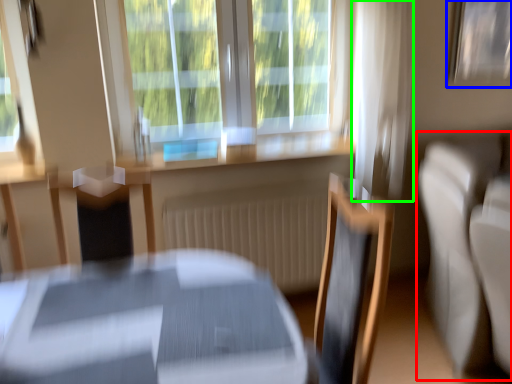
Question: Estimate the real-world distances between objects in this image. Which object is farther from couch (highlighted by a red box), picture frame (highlighted by a blue box) or curtain (highlighted by a green box)?

Choices:
 (A) picture frame
 (B) curtain

Answer: (A)